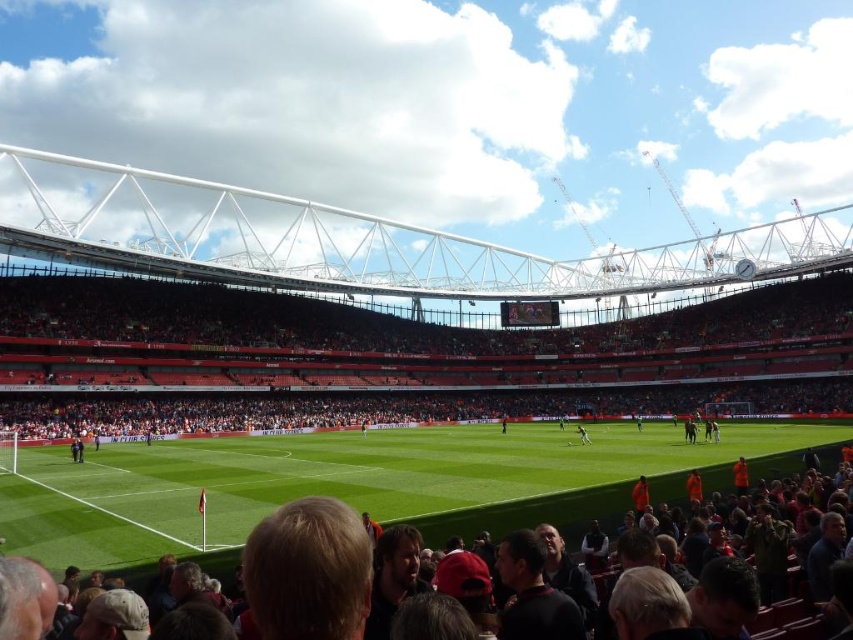
Which of these two, green grass football field at center or green grass at center, stands shorter?

With less height is green grass at center.

You are a GUI agent. You are given a task and a screenshot of the screen. Output one action in this format:
    pyautogui.click(x=<x>, y=<y>)
    Task: Click on the green grass football field at center
    The image size is (853, 640).
    Given the screenshot: What is the action you would take?
    pyautogui.click(x=363, y=481)

Looking at this image, does red plastic seats at center appear on the left side of green grass at center?

Correct, you'll find red plastic seats at center to the left of green grass at center.

The height and width of the screenshot is (640, 853). Identify the location of red plastic seats at center. (395, 358).

You are a GUI agent. You are given a task and a screenshot of the screen. Output one action in this format:
    pyautogui.click(x=<x>, y=<y>)
    Task: Click on the red plastic seats at center
    Image resolution: width=853 pixels, height=640 pixels.
    Given the screenshot: What is the action you would take?
    pyautogui.click(x=395, y=358)

Between red plastic seats at center and green grass football field at center, which one appears on the right side from the viewer's perspective?

green grass football field at center

Who is shorter, red plastic seats at center or green grass football field at center?

green grass football field at center is shorter.

Who is more distant from viewer, (x=538, y=344) or (x=73, y=474)?

The point (x=538, y=344) is more distant.

Find the location of a particular element. This screenshot has height=640, width=853. red plastic seats at center is located at coordinates (395, 358).